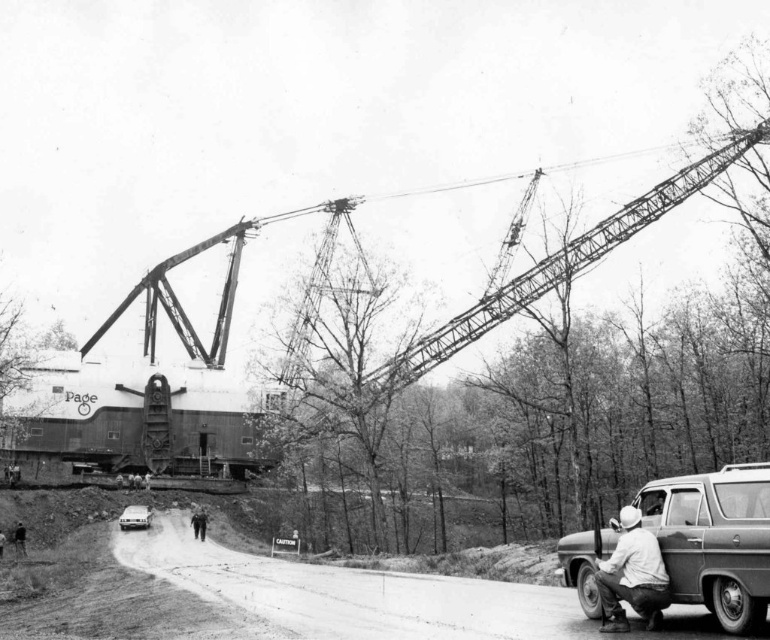
Who is taller, rubber/smooth tire at lower right or white matte car at center?

rubber/smooth tire at lower right

Is rubber/smooth tire at lower right positioned behind white matte car at center?

That is False.

Who is more forward, (735, 595) or (142, 522)?

Positioned in front is point (735, 595).

Image resolution: width=770 pixels, height=640 pixels. I want to click on rubber/smooth tire at lower right, so click(735, 605).

Is the position of metallic silver van at lower right more distant than that of white matte car at center?

No, it is in front of white matte car at center.

Is metallic silver van at lower right to the right of white matte car at center from the viewer's perspective?

Indeed, metallic silver van at lower right is positioned on the right side of white matte car at center.

Is point (658, 480) behind point (149, 520)?

No, (658, 480) is in front of (149, 520).

At what (x,y) coordinates should I click in order to perform the action: click on metallic silver van at lower right. Please return your answer as a coordinate pair (x, y). The height and width of the screenshot is (640, 770). Looking at the image, I should click on (715, 540).

Looking at this image, is metallic trailer truck at center shorter than rubber/smooth tire at lower right?

Incorrect, metallic trailer truck at center's height does not fall short of rubber/smooth tire at lower right's.

Does metallic trailer truck at center appear under rubber/smooth tire at lower right?

No, metallic trailer truck at center is not below rubber/smooth tire at lower right.

Is point (62, 412) positioned behind point (755, 624)?

That is True.

This screenshot has width=770, height=640. In order to click on metallic trailer truck at center in this screenshot , I will do `click(139, 419)`.